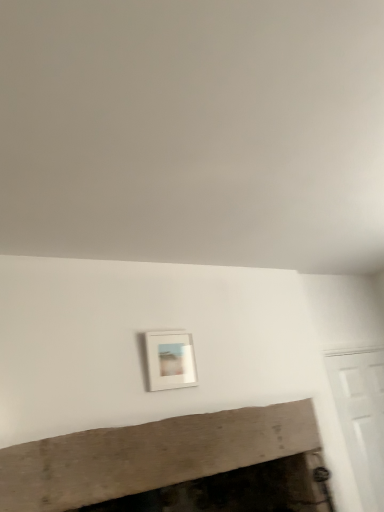
Question: Is white matte picture frame at center facing away from wooden mantel at lower center?

Choices:
 (A) no
 (B) yes

Answer: (A)

Question: Does white matte picture frame at center appear on the left side of wooden mantel at lower center?

Choices:
 (A) no
 (B) yes

Answer: (A)

Question: Considering the relative sizes of white matte picture frame at center and wooden mantel at lower center in the image provided, is white matte picture frame at center wider than wooden mantel at lower center?

Choices:
 (A) yes
 (B) no

Answer: (B)

Question: From the image's perspective, is white matte picture frame at center beneath wooden mantel at lower center?

Choices:
 (A) yes
 (B) no

Answer: (B)

Question: Is white matte picture frame at center outside of wooden mantel at lower center?

Choices:
 (A) yes
 (B) no

Answer: (A)

Question: Is white matte picture frame at center smaller than wooden mantel at lower center?

Choices:
 (A) yes
 (B) no

Answer: (A)

Question: Does wooden mantel at lower center have a greater width compared to white matte picture frame at center?

Choices:
 (A) no
 (B) yes

Answer: (B)

Question: From the image's perspective, is wooden mantel at lower center under white matte picture frame at center?

Choices:
 (A) no
 (B) yes

Answer: (B)

Question: Is wooden mantel at lower center bigger than white matte picture frame at center?

Choices:
 (A) no
 (B) yes

Answer: (B)

Question: Considering the relative sizes of wooden mantel at lower center and white matte picture frame at center in the image provided, is wooden mantel at lower center shorter than white matte picture frame at center?

Choices:
 (A) no
 (B) yes

Answer: (B)

Question: Can you confirm if wooden mantel at lower center is taller than white matte picture frame at center?

Choices:
 (A) yes
 (B) no

Answer: (B)

Question: Is wooden mantel at lower center aimed at white matte picture frame at center?

Choices:
 (A) yes
 (B) no

Answer: (B)

Question: Is point (306, 498) closer or farther from the camera than point (183, 379)?

Choices:
 (A) closer
 (B) farther

Answer: (B)